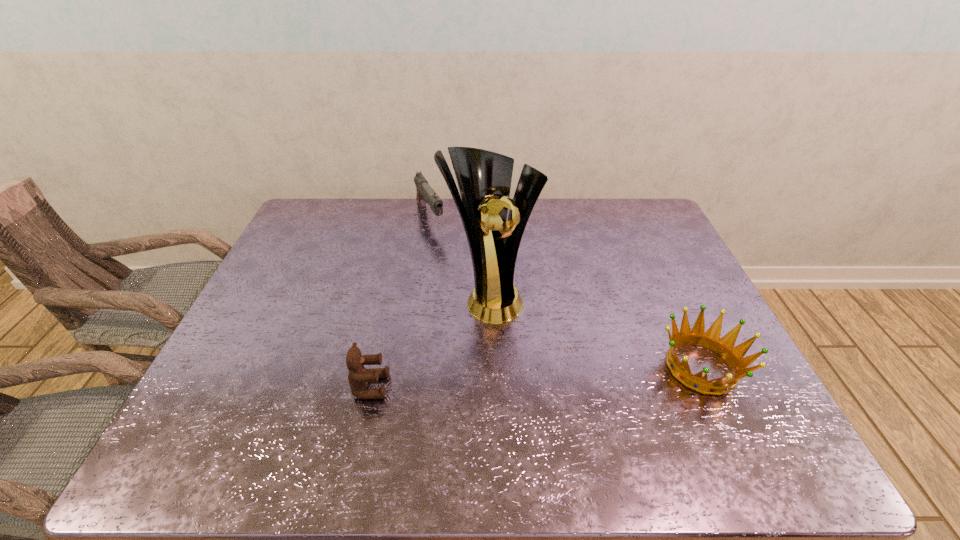
At what (x,y) coordinates should I click in order to perform the action: click on vacant space at the near edge. Please return your answer as a coordinate pair (x, y). Looking at the image, I should click on (573, 387).

In the image, there is a desktop. In order to click on vacant space at the right edge in this screenshot , I will do `click(697, 306)`.

The height and width of the screenshot is (540, 960). Find the location of `free spot at the far right corner of the desktop`. free spot at the far right corner of the desktop is located at coordinates (629, 230).

This screenshot has height=540, width=960. Identify the location of vacant region between the second farthest object and the teddy bear. (431, 341).

Identify the location of vacant space that is in between the farthest object and the teddy bear. (400, 302).

I want to click on blank region between the gun and the tallest object, so click(x=461, y=257).

Identify the location of vacant space in between the rightmost object and the farthest object. This screenshot has width=960, height=540. (565, 293).

Locate an element on the screen. Image resolution: width=960 pixels, height=540 pixels. free space between the farthest object and the teddy bear is located at coordinates (400, 302).

I want to click on empty space between the teddy bear and the third nearest object, so click(x=431, y=341).

Where is `free area in between the crown and the award`? Image resolution: width=960 pixels, height=540 pixels. free area in between the crown and the award is located at coordinates (596, 332).